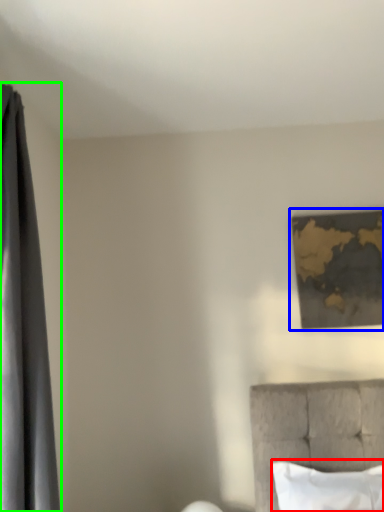
Question: Based on their relative distances, which object is nearer to pillow (highlighted by a red box)? Choose from picture frame (highlighted by a blue box) and curtain (highlighted by a green box).

Choices:
 (A) picture frame
 (B) curtain

Answer: (A)